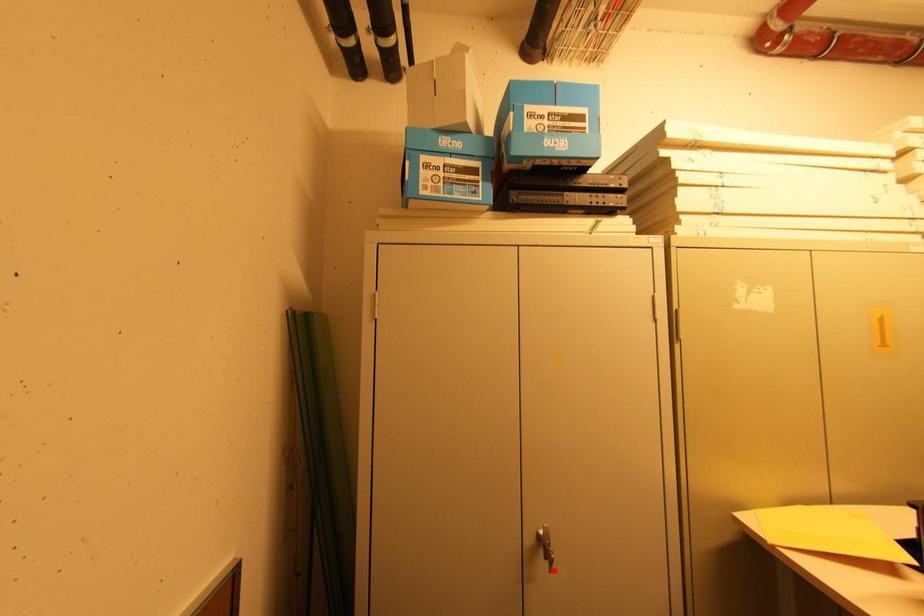
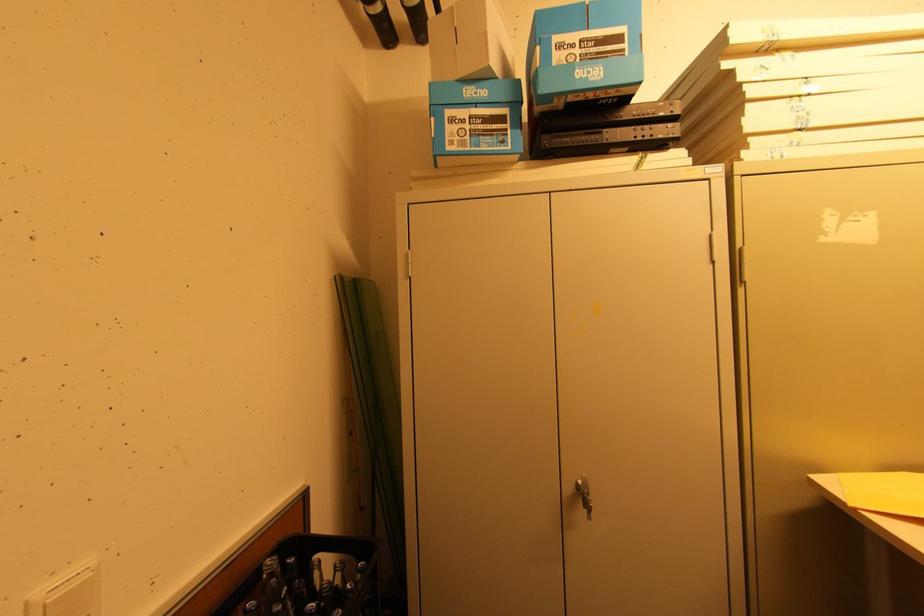
The point at the highlighted location is marked in the first image. Where is the corresponding point in the second image?

(592, 519)